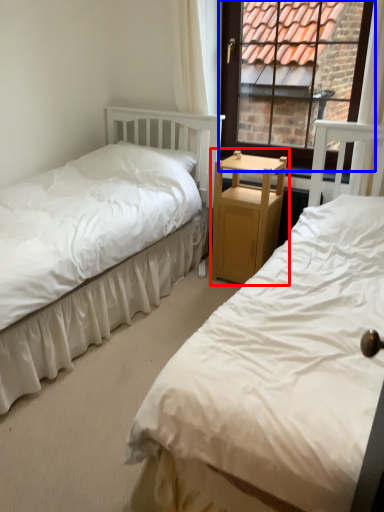
Question: Among these objects, which one is farthest to the camera, nightstand (highlighted by a red box) or window (highlighted by a blue box)?

Choices:
 (A) nightstand
 (B) window

Answer: (A)